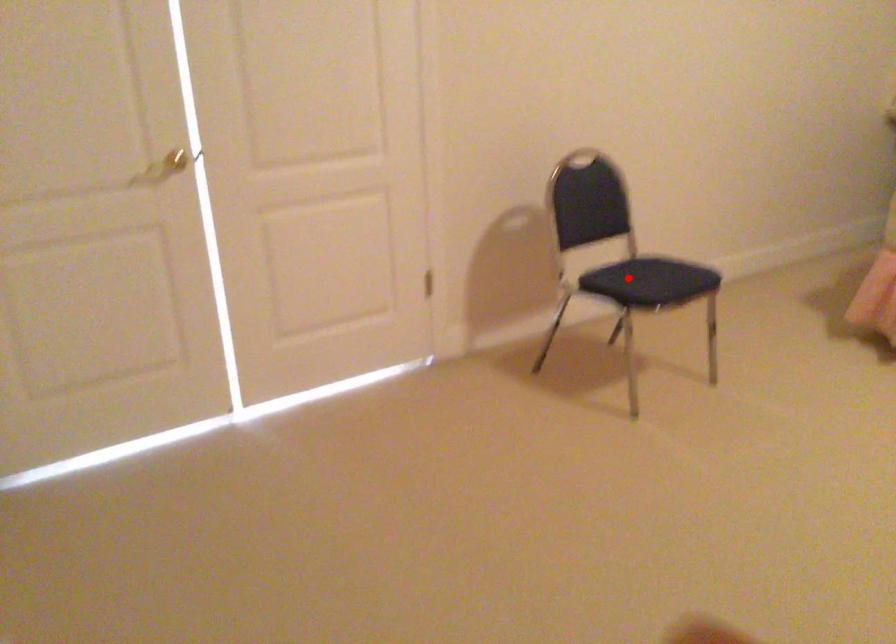
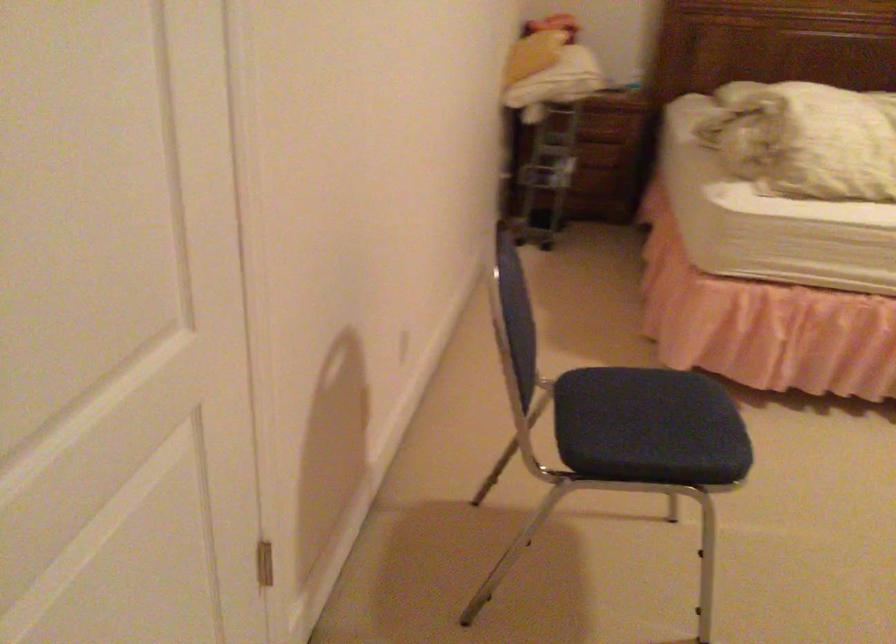
Question: I am providing you with two images of the same scene from different viewpoints. Image1 has a red point marked. In image2, the corresponding 3D location appears at what relative position? Reply with the corresponding letter.

Choices:
 (A) Closer
 (B) Farther

Answer: (A)